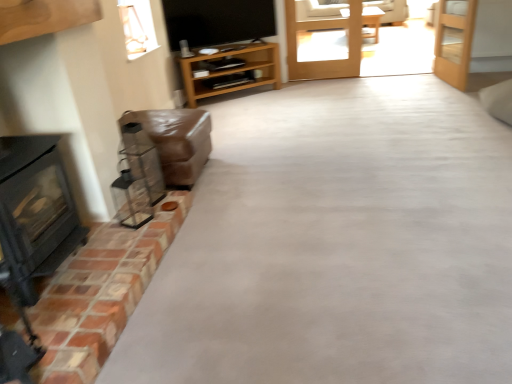
Measure the distance between clear glass door at center, acting as the first door starting from the left, and camera.

clear glass door at center, acting as the first door starting from the left, and camera are 15.39 feet apart from each other.

In order to click on clear glass door at center, acting as the first door starting from the left in this screenshot , I will do `click(324, 29)`.

What do you see at coordinates (100, 294) in the screenshot?
I see `red brick fireplace at lower left` at bounding box center [100, 294].

This screenshot has height=384, width=512. What are the coordinates of `brown leather couch at left` in the screenshot? It's located at (176, 141).

From the image's perspective, is red brick fireplace at lower left under clear glass door at center, the second door in the right-to-left sequence?

Correct, red brick fireplace at lower left appears lower than clear glass door at center, the second door in the right-to-left sequence, in the image.

Is red brick fireplace at lower left aimed at clear glass door at center, acting as the first door starting from the left?

No, red brick fireplace at lower left does not turn towards clear glass door at center, acting as the first door starting from the left.

Considering the sizes of objects red brick fireplace at lower left and clear glass door at center, acting as the first door starting from the left, in the image provided, who is smaller, red brick fireplace at lower left or clear glass door at center, acting as the first door starting from the left,?

With smaller size is clear glass door at center, acting as the first door starting from the left.

Does red brick fireplace at lower left appear on the left side of clear glass door at center, the second door in the right-to-left sequence?

Correct, you'll find red brick fireplace at lower left to the left of clear glass door at center, the second door in the right-to-left sequence.

Is point (167, 181) positioned behind point (99, 309)?

Yes, point (167, 181) is behind point (99, 309).

From a real-world perspective, is brown leather couch at left over red brick fireplace at lower left?

Yes, from a real-world perspective, brown leather couch at left is on top of red brick fireplace at lower left.

Could you tell me if brown leather couch at left is facing red brick fireplace at lower left?

No, brown leather couch at left is not aimed at red brick fireplace at lower left.

Is brown leather couch at left far away from light beige fabric couch at upper center?

Yes, brown leather couch at left is far from light beige fabric couch at upper center.

Which of these two, brown leather couch at left or light beige fabric couch at upper center, is wider?

light beige fabric couch at upper center is wider.

This screenshot has height=384, width=512. In order to click on couch above the brown leather couch at left (from the image's perspective) in this screenshot , I will do [321, 13].

Based on the photo, between wooden door at upper right, placed as the second door when sorted from left to right, and brown leather couch at left, which one has smaller width?

With smaller width is wooden door at upper right, placed as the second door when sorted from left to right.

Looking at this image, is wooden door at upper right, placed as the second door when sorted from left to right, not close to brown leather couch at left?

wooden door at upper right, placed as the second door when sorted from left to right, is far away from brown leather couch at left.

From the image's perspective, does wooden door at upper right, which is the first door in right-to-left order, appear lower than brown leather couch at left?

No.

Does wooden door at upper right, which is the first door in right-to-left order, appear on the left side of brown leather couch at left?

No.

Does red brick fireplace at lower left touch light beige fabric couch at upper center?

No, red brick fireplace at lower left is not making contact with light beige fabric couch at upper center.

Is red brick fireplace at lower left inside the boundaries of light beige fabric couch at upper center, or outside?

red brick fireplace at lower left is spatially situated outside light beige fabric couch at upper center.

Is red brick fireplace at lower left facing towards light beige fabric couch at upper center?

No, red brick fireplace at lower left is not facing towards light beige fabric couch at upper center.

Consider the image. Considering the positions of objects red brick fireplace at lower left and light beige fabric couch at upper center in the image provided, who is more to the left, red brick fireplace at lower left or light beige fabric couch at upper center?

red brick fireplace at lower left.

You are a GUI agent. You are given a task and a screenshot of the screen. Output one action in this format:
    pyautogui.click(x=<x>, y=<y>)
    Task: Click on the table located on the right of wooden shelf at center
    
    Given the screenshot: What is the action you would take?
    pyautogui.click(x=372, y=21)

Which of these two, light brown wooden table at center or wooden shelf at center, is wider?

Wider between the two is light brown wooden table at center.

Are light brown wooden table at center and wooden shelf at center far apart?

light brown wooden table at center is far away from wooden shelf at center.

Based on the photo, can you confirm if wooden shelf at center is positioned to the right of wooden door at upper right, which is the first door in right-to-left order?

No.

Is wooden shelf at center inside or outside of wooden door at upper right, which is the first door in right-to-left order?

wooden shelf at center is spatially situated outside wooden door at upper right, which is the first door in right-to-left order.

From the image's perspective, which is below, wooden shelf at center or wooden door at upper right, which is the first door in right-to-left order?

wooden shelf at center appears lower in the image.

Is wooden shelf at center taller than wooden door at upper right, placed as the second door when sorted from left to right?

Incorrect, the height of wooden shelf at center is not larger of that of wooden door at upper right, placed as the second door when sorted from left to right.

I want to click on brickwork in front of the clear glass door at center, acting as the first door starting from the left, so click(100, 294).

The width and height of the screenshot is (512, 384). I want to click on furniture lying above the red brick fireplace at lower left (from the image's perspective), so click(x=176, y=141).

Estimate the real-world distances between objects in this image. Which object is further from black matte wood burning stove at left, wooden shelf at center or red brick fireplace at lower left?

wooden shelf at center.

From the image, which object appears to be farther from light beige fabric couch at upper center, black matte wood burning stove at left or light brown wooden table at center?

black matte wood burning stove at left.

Estimate the real-world distances between objects in this image. Which object is closer to brown leather couch at left, red brick fireplace at lower left or light brown wooden table at center?

The object closer to brown leather couch at left is red brick fireplace at lower left.

Based on their spatial positions, is wooden door at upper right, which is the first door in right-to-left order, or red brick fireplace at lower left closer to light brown wooden table at center?

The object closer to light brown wooden table at center is wooden door at upper right, which is the first door in right-to-left order.

Which object lies nearer to the anchor point light beige fabric couch at upper center, wooden door at upper right, placed as the second door when sorted from left to right, or red brick fireplace at lower left?

Among the two, wooden door at upper right, placed as the second door when sorted from left to right, is located nearer to light beige fabric couch at upper center.

From the image, which object appears to be farther from light brown wooden table at center, black matte wood burning stove at left or red brick fireplace at lower left?

black matte wood burning stove at left is further to light brown wooden table at center.

Looking at the image, which one is located closer to clear glass door at center, the second door in the right-to-left sequence, light beige fabric couch at upper center or wooden shelf at center?

light beige fabric couch at upper center is closer to clear glass door at center, the second door in the right-to-left sequence.

Looking at the image, which one is located further to wooden shelf at center, clear glass door at center, acting as the first door starting from the left, or light beige fabric couch at upper center?

light beige fabric couch at upper center is positioned further to the anchor wooden shelf at center.

I want to click on door located between red brick fireplace at lower left and wooden shelf at center in the depth direction, so click(454, 41).

Identify the location of furniture between red brick fireplace at lower left and wooden door at upper right, placed as the second door when sorted from left to right, in the horizontal direction. This screenshot has height=384, width=512. (176, 141).

Where is `furniture between red brick fireplace at lower left and light beige fabric couch at upper center from front to back`? This screenshot has height=384, width=512. furniture between red brick fireplace at lower left and light beige fabric couch at upper center from front to back is located at coordinates (176, 141).

Where is `brickwork between black matte wood burning stove at left and clear glass door at center, the second door in the right-to-left sequence, from front to back`? The width and height of the screenshot is (512, 384). brickwork between black matte wood burning stove at left and clear glass door at center, the second door in the right-to-left sequence, from front to back is located at coordinates (100, 294).